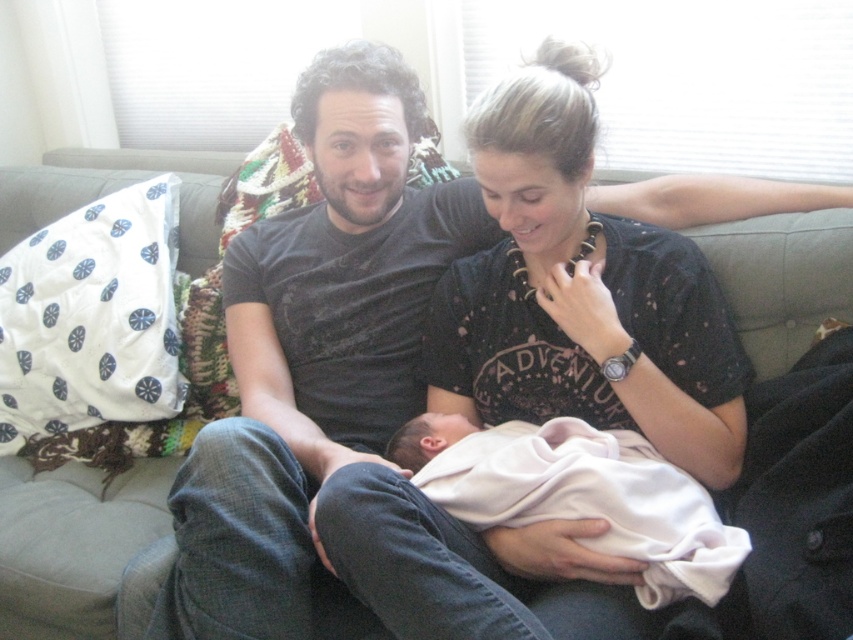
You are a photographer setting up for a family portrait. The black dotted shirt at center is positioned at coordinates 0.456, 0.681. To ensure the baby is centered in the frame, where should you adjust the camera focus relative to the shirt?

To center the baby in the frame, adjust the camera focus slightly downward and to the right of the black dotted shirt at center, as the baby is resting on the laps of the adults and positioned lower and to the right relative to the shirt.

You are a photographer taking a closeup shot of the black dotted shirt at center and the pink soft fabric newborn at center. Which object should you focus on first if you want to capture both clearly in the same frame?

The black dotted shirt at center has a larger size compared to the pink soft fabric newborn at center, so you should focus on the larger object first to ensure both are in focus.